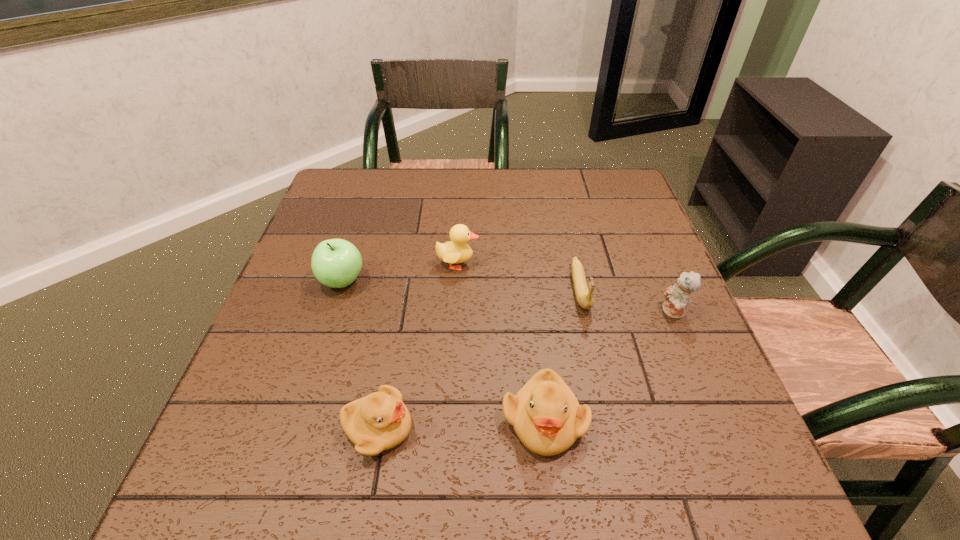
Identify the location of the leftmost duckling. (380, 421).

The height and width of the screenshot is (540, 960). In order to click on the second object from left to right in this screenshot , I will do `click(380, 421)`.

Identify the location of the fourth object from left to right. The width and height of the screenshot is (960, 540). (545, 414).

Find the location of `the fourth object from right to left`. the fourth object from right to left is located at coordinates pyautogui.click(x=456, y=251).

Identify the location of the farthest duckling. This screenshot has width=960, height=540. (456, 251).

In order to click on the fifth object from left to right in this screenshot , I will do `click(584, 297)`.

Find the location of a particular element. apple is located at coordinates (336, 263).

Locate an element on the screen. This screenshot has width=960, height=540. teddy bear is located at coordinates (677, 297).

Identify the location of free space located on the front-facing side of the shortest duckling. The image size is (960, 540). (640, 428).

Identify the location of vacant region located 0.220m on the front-facing side of the farthest duckling. (568, 264).